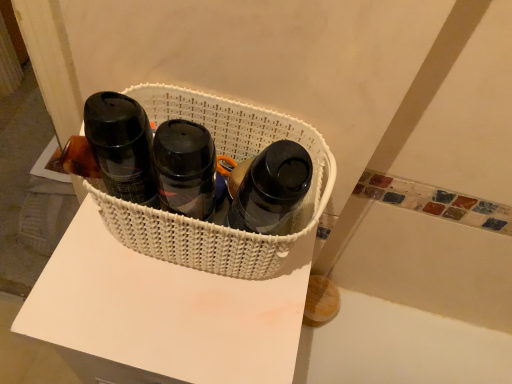
Question: Is matte black thermos at left, marked as the 1th bottle in a left-to-right arrangement, outside white woven basket at center?

Choices:
 (A) yes
 (B) no

Answer: (A)

Question: Considering the relative positions of matte black thermos at left, marked as the 1th bottle in a left-to-right arrangement, and white woven basket at center in the image provided, is matte black thermos at left, marked as the 1th bottle in a left-to-right arrangement, to the right of white woven basket at center from the viewer's perspective?

Choices:
 (A) yes
 (B) no

Answer: (A)

Question: Is matte black thermos at left, the 2th bottle from the right, positioned behind white woven basket at center?

Choices:
 (A) no
 (B) yes

Answer: (A)

Question: From a real-world perspective, is matte black thermos at left, marked as the 1th bottle in a left-to-right arrangement, on white woven basket at center?

Choices:
 (A) no
 (B) yes

Answer: (B)

Question: From a real-world perspective, is matte black thermos at left, marked as the 1th bottle in a left-to-right arrangement, physically below white woven basket at center?

Choices:
 (A) yes
 (B) no

Answer: (B)

Question: Is white woven basket at center inside or outside of white woven basket at center?

Choices:
 (A) inside
 (B) outside

Answer: (B)

Question: Does point (184, 375) appear closer or farther from the camera than point (249, 135)?

Choices:
 (A) farther
 (B) closer

Answer: (B)

Question: From a real-world perspective, relative to white woven basket at center, is white woven basket at center vertically above or below?

Choices:
 (A) above
 (B) below

Answer: (B)

Question: Is white woven basket at center taller or shorter than white woven basket at center?

Choices:
 (A) short
 (B) tall

Answer: (B)

Question: Is point (121, 102) positioned closer to the camera than point (244, 302)?

Choices:
 (A) farther
 (B) closer

Answer: (B)

Question: Is matte black thermos at left, the 2th bottle from the right, wider or thinner than white woven basket at center?

Choices:
 (A) wide
 (B) thin

Answer: (B)

Question: Relative to white woven basket at center, is matte black thermos at left, the 2th bottle from the right, in front or behind?

Choices:
 (A) behind
 (B) front

Answer: (B)

Question: Is matte black thermos at left, marked as the 1th bottle in a left-to-right arrangement, to the left or to the right of white woven basket at center in the image?

Choices:
 (A) right
 (B) left

Answer: (A)

Question: From the image's perspective, is white woven basket at center positioned above or below matte black bottle at center, placed as the second bottle when sorted from left to right?

Choices:
 (A) below
 (B) above

Answer: (A)

Question: In terms of size, does white woven basket at center appear bigger or smaller than matte black bottle at center, which ranks as the first bottle in right-to-left order?

Choices:
 (A) small
 (B) big

Answer: (B)